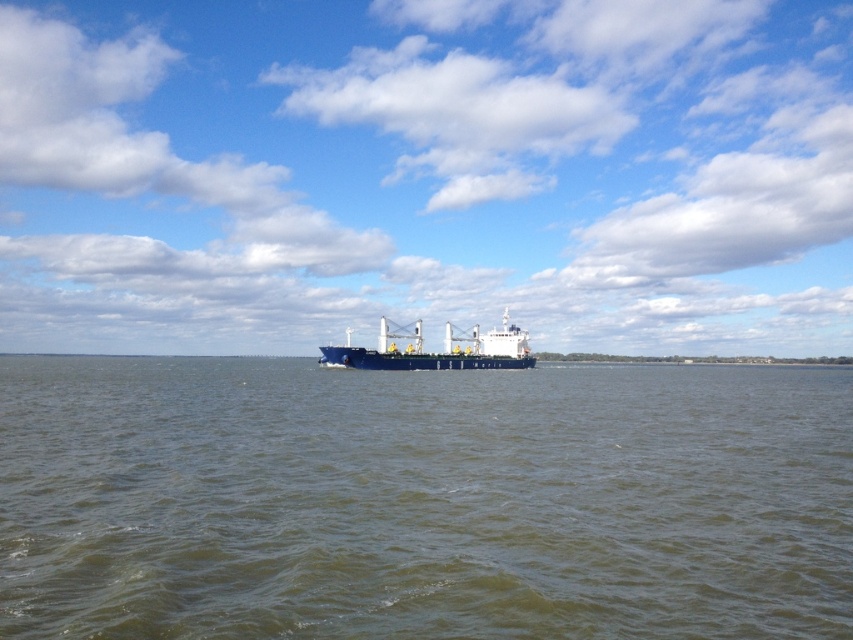
You are standing on the deck of the cargo ship and want to take a photo of the point at coordinates point [548,564]. If your camera has a maximum range of 10 meters, will you be able to capture the point in your photo?

The point [548,564] is 10.67 meters away from the camera, which exceeds the camera maximum range of 10 meters. Therefore, the camera cannot capture the point in the photo.